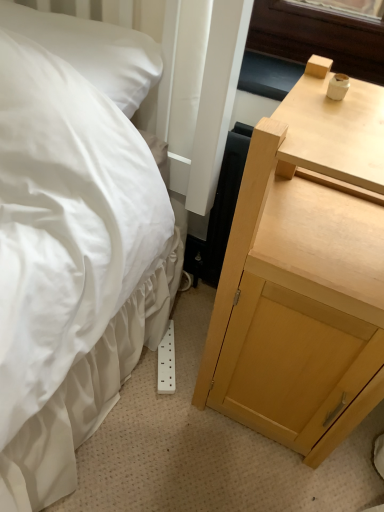
This screenshot has width=384, height=512. In order to click on light wood nightstand at right in this screenshot , I will do `click(303, 275)`.

Describe the element at coordinates (303, 275) in the screenshot. I see `light wood nightstand at right` at that location.

What is the approximate width of light wood nightstand at right?

12.79 inches.

Image resolution: width=384 pixels, height=512 pixels. Find the location of `white satin pillow at upper left`. white satin pillow at upper left is located at coordinates (93, 51).

What do you see at coordinates (93, 51) in the screenshot?
I see `white satin pillow at upper left` at bounding box center [93, 51].

Where is `light wood nightstand at right`? light wood nightstand at right is located at coordinates (303, 275).

Is light wood nightstand at right at the right side of white satin pillow at upper left?

Yes.

Does light wood nightstand at right lie in front of white satin pillow at upper left?

That is True.

Is point (354, 166) positioned before point (84, 75)?

Yes, it is.

From the image's perspective, which object appears higher, light wood nightstand at right or white satin pillow at upper left?

white satin pillow at upper left.

From a real-world perspective, is light wood nightstand at right on top of white satin pillow at upper left?

No, from a real-world perspective, light wood nightstand at right is not above white satin pillow at upper left.

In the scene shown: Which object is thinner, light wood nightstand at right or white satin pillow at upper left?

white satin pillow at upper left.

Considering the sizes of light wood nightstand at right and white satin pillow at upper left in the image, is light wood nightstand at right taller or shorter than white satin pillow at upper left?

Clearly, light wood nightstand at right is taller compared to white satin pillow at upper left.

Between light wood nightstand at right and white satin pillow at upper left, which one has smaller size?

Smaller between the two is white satin pillow at upper left.

Is light wood nightstand at right not within white satin pillow at upper left?

Yes, light wood nightstand at right is located beyond the bounds of white satin pillow at upper left.

Is light wood nightstand at right far away from white satin pillow at upper left?

Actually, light wood nightstand at right and white satin pillow at upper left are a little close together.

Could you tell me if light wood nightstand at right is turned towards white satin pillow at upper left?

No, light wood nightstand at right is not facing towards white satin pillow at upper left.

Locate an element on the screen. The width and height of the screenshot is (384, 512). pillow that is behind the light wood nightstand at right is located at coordinates (93, 51).

Which is more to the right, white satin pillow at upper left or light wood nightstand at right?

From the viewer's perspective, light wood nightstand at right appears more on the right side.

Which is in front, white satin pillow at upper left or light wood nightstand at right?

light wood nightstand at right is more forward.

Is point (155, 74) positioned behind point (302, 84)?

Yes, it is.

From the image's perspective, would you say white satin pillow at upper left is shown under light wood nightstand at right?

No, from the image's perspective, white satin pillow at upper left is not below light wood nightstand at right.

From a real-world perspective, is white satin pillow at upper left on top of light wood nightstand at right?

Yes, from a real-world perspective, white satin pillow at upper left is above light wood nightstand at right.

Considering the relative sizes of white satin pillow at upper left and light wood nightstand at right in the image provided, is white satin pillow at upper left wider than light wood nightstand at right?

In fact, white satin pillow at upper left might be narrower than light wood nightstand at right.

Is white satin pillow at upper left taller than light wood nightstand at right?

No.

Considering the relative sizes of white satin pillow at upper left and light wood nightstand at right in the image provided, is white satin pillow at upper left bigger than light wood nightstand at right?

No, white satin pillow at upper left is not bigger than light wood nightstand at right.

Can we say white satin pillow at upper left lies outside light wood nightstand at right?

white satin pillow at upper left is positioned outside light wood nightstand at right.

Is there a large distance between white satin pillow at upper left and light wood nightstand at right?

No, white satin pillow at upper left is in close proximity to light wood nightstand at right.

Could you tell me if white satin pillow at upper left is turned towards light wood nightstand at right?

No, white satin pillow at upper left is not aimed at light wood nightstand at right.

What's the angular difference between white satin pillow at upper left and light wood nightstand at right's facing directions?

0.635 degrees.

In the scene shown: How much distance is there between white satin pillow at upper left and light wood nightstand at right?

They are 19.69 inches apart.

The height and width of the screenshot is (512, 384). Find the location of `nightstand in front of the white satin pillow at upper left`. nightstand in front of the white satin pillow at upper left is located at coordinates (303, 275).

This screenshot has height=512, width=384. Find the location of `nightstand below the white satin pillow at upper left (from the image's perspective)`. nightstand below the white satin pillow at upper left (from the image's perspective) is located at coordinates [303, 275].

This screenshot has width=384, height=512. What are the coordinates of `nightstand below the white satin pillow at upper left (from a real-world perspective)` in the screenshot? It's located at (303, 275).